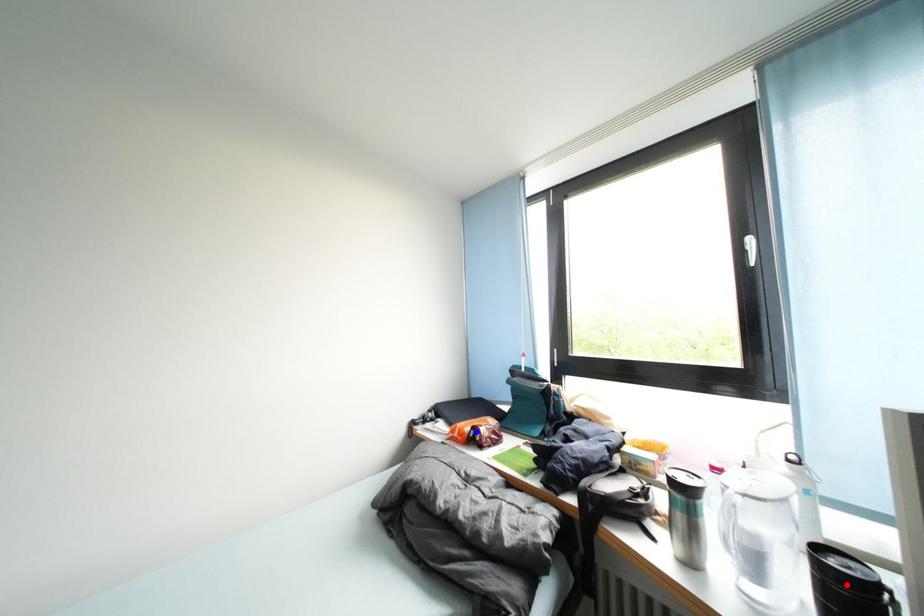
Question: In the image, two points are highlighted. Which point is nearer to the camera? Reply with the corresponding letter.

Choices:
 (A) blue point
 (B) red point

Answer: (B)